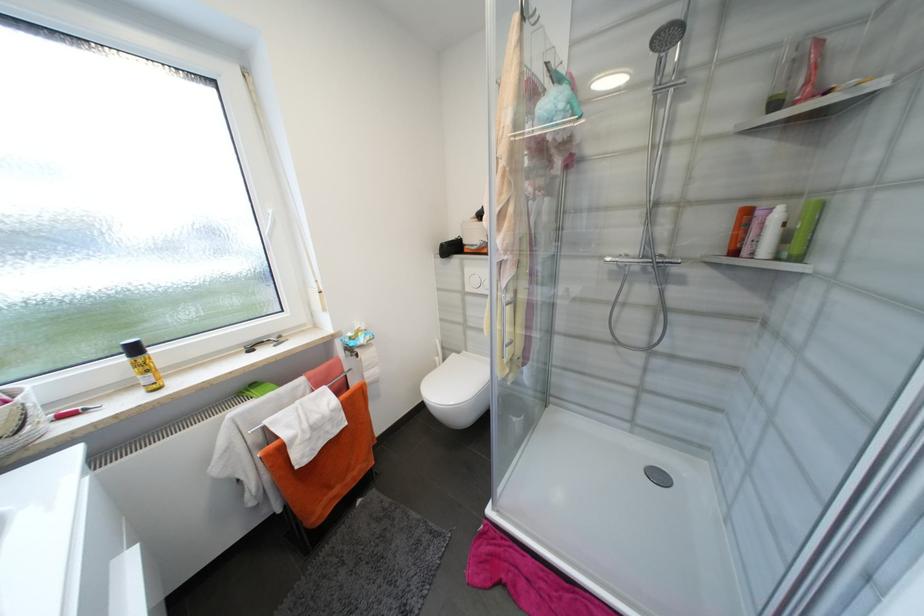
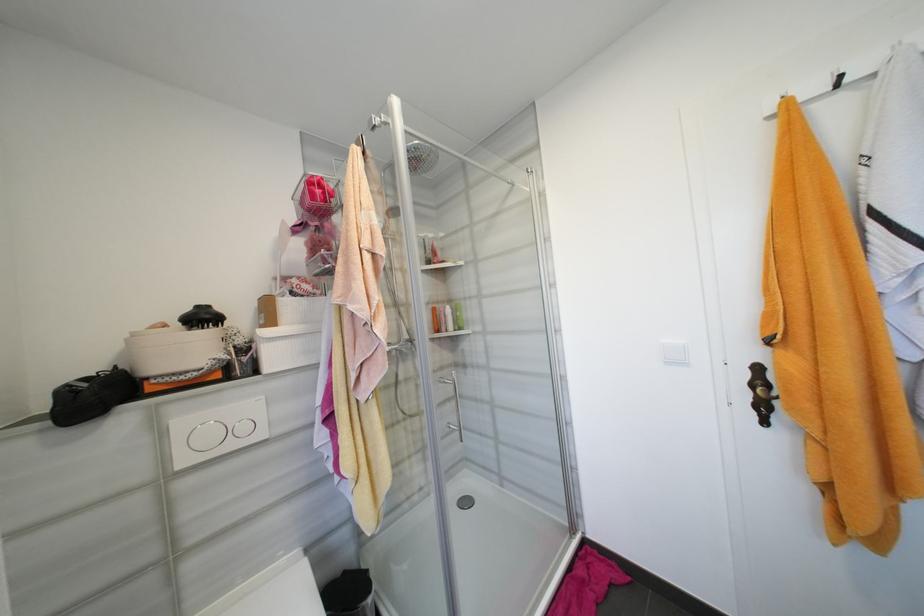
Find the pixel in the second image that matches the point at 751,253 in the first image.

(450, 330)